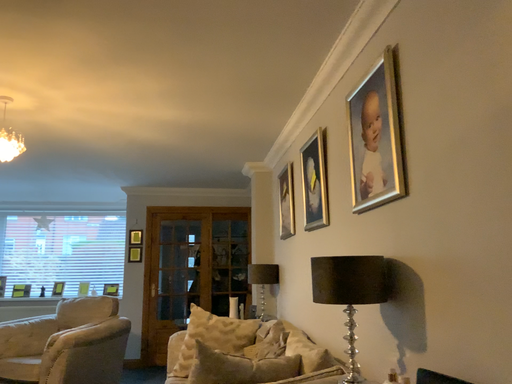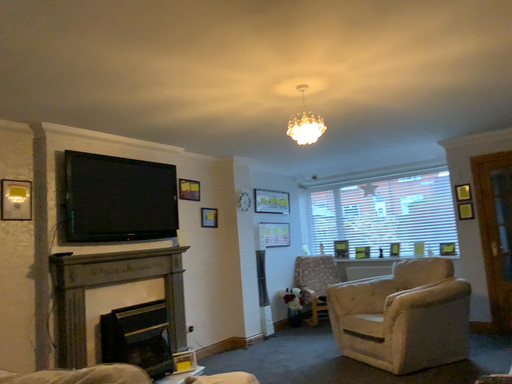
Question: How did the camera likely rotate when shooting the video?

Choices:
 (A) rotated left
 (B) rotated right

Answer: (A)